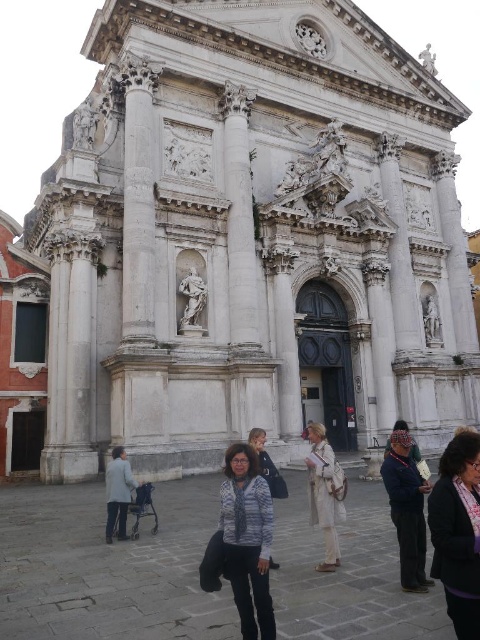
Question: Does dark blue fabric at center have a smaller size compared to blue knit sweater at center?

Choices:
 (A) yes
 (B) no

Answer: (B)

Question: Which point is closer to the camera?

Choices:
 (A) striped sweater at center
 (B) dark blue fabric at center
 (C) matte black jacket at lower right

Answer: (C)

Question: Which object is positioned farthest from the white marble column at left?

Choices:
 (A) dark blue fabric jacket at center
 (B) light gray fabric stroller at lower left
 (C) blue knit sweater at center
 (D) striped sweater at center

Answer: (A)

Question: Can you confirm if white marble column at left is positioned above blue knit sweater at center?

Choices:
 (A) yes
 (B) no

Answer: (A)

Question: Which point is farther to the camera?

Choices:
 (A) white marble column at center
 (B) striped sweater at center
 (C) light beige fabric dress at center

Answer: (A)

Question: Does matte black jacket at lower right appear under dark blue fabric jacket at center?

Choices:
 (A) no
 (B) yes

Answer: (A)